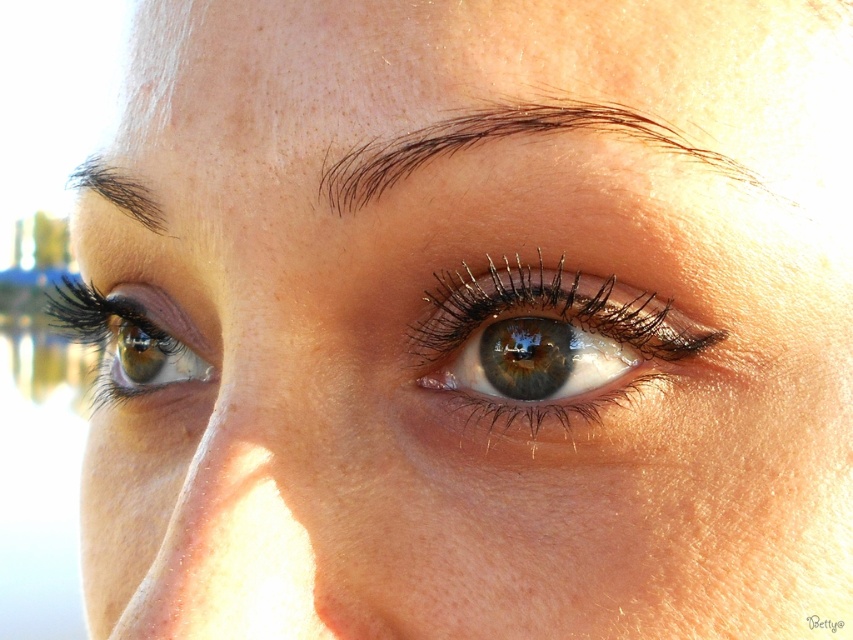
Question: Is matte brown eye at lower left in front of dark brown hair at upper left?

Choices:
 (A) no
 (B) yes

Answer: (A)

Question: Which point appears farthest from the camera in this image?

Choices:
 (A) (747, 179)
 (B) (68, 177)
 (C) (166, 339)

Answer: (C)

Question: Which of the following is the closest to the observer?

Choices:
 (A) (136, 344)
 (B) (103, 198)
 (C) (686, 140)
 (D) (447, 310)

Answer: (C)

Question: Which object is the closest to the brown hair at upper center?

Choices:
 (A) brown matte eye at center
 (B) matte brown eye at lower left

Answer: (A)

Question: From the image, what is the correct spatial relationship of brown hair at upper center in relation to matte brown eye at lower left?

Choices:
 (A) above
 (B) below

Answer: (A)

Question: Does brown matte eye at center have a lesser width compared to brown hair at upper center?

Choices:
 (A) yes
 (B) no

Answer: (A)